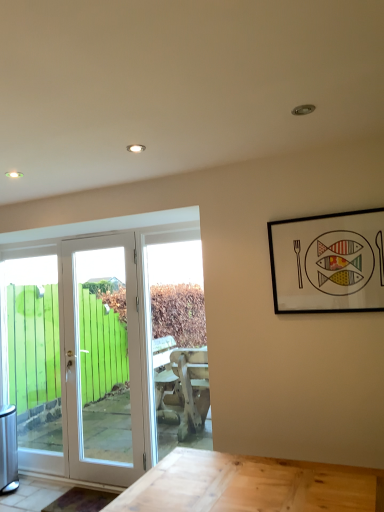
In order to face white glossy door at left, the second door in the left-to-right sequence, should I rotate leftwards or rightwards?

A 11.635 degree turn to the left will do.

What are the coordinates of `transparent glass door at left` in the screenshot? It's located at (33, 358).

What do you see at coordinates (328, 263) in the screenshot? I see `black matte picture frame at upper right` at bounding box center [328, 263].

At what (x,y) coordinates should I click in order to perform the action: click on white glossy door at left, which appears as the first door when viewed from the right. Please return your answer as a coordinate pair (x, y). Image resolution: width=384 pixels, height=512 pixels. Looking at the image, I should click on (104, 358).

Can you confirm if white glossy door at left, positioned as the second door in right-to-left order, is wider than white glossy door at left, the second door in the left-to-right sequence?

No.

Measure the distance between white glossy door at left, positioned as the second door in right-to-left order, and white glossy door at left, the second door in the left-to-right sequence.

white glossy door at left, positioned as the second door in right-to-left order, is 5.31 inches away from white glossy door at left, the second door in the left-to-right sequence.

Are white glossy door at left, the 1th door when ordered from left to right, and white glossy door at left, which appears as the first door when viewed from the right, far apart?

No.

Is white glossy door at left, which appears as the first door when viewed from the right, at the back of white glossy door at left, positioned as the second door in right-to-left order?

That's right, white glossy door at left, positioned as the second door in right-to-left order, is facing away from white glossy door at left, which appears as the first door when viewed from the right.

Is white glossy door at left, the second door in the left-to-right sequence, wider or thinner than transparent glass door at left?

white glossy door at left, the second door in the left-to-right sequence, is wider than transparent glass door at left.

Identify the location of the 1st door in front of the transparent glass door at left, starting your count from the anchor. (104, 358).

Is white glossy door at left, the second door in the left-to-right sequence, situated inside transparent glass door at left or outside?

white glossy door at left, the second door in the left-to-right sequence, exists outside the volume of transparent glass door at left.

Are white glossy door at left, positioned as the second door in right-to-left order, and transparent glass door at left located far from each other?

Actually, white glossy door at left, positioned as the second door in right-to-left order, and transparent glass door at left are a little close together.

What's the angular difference between white glossy door at left, the 1th door when ordered from left to right, and transparent glass door at left's facing directions?

They differ by 0.123 degrees in their facing directions.

Could you tell me if white glossy door at left, positioned as the second door in right-to-left order, is turned towards transparent glass door at left?

Yes, white glossy door at left, positioned as the second door in right-to-left order, is aimed at transparent glass door at left.

Is white glossy door at left, positioned as the second door in right-to-left order, wider than transparent glass door at left?

No.

How different are the orientations of white glossy door at left, which appears as the first door when viewed from the right, and white glossy door at left, positioned as the second door in right-to-left order, in degrees?

A: The angle between the facing direction of white glossy door at left, which appears as the first door when viewed from the right, and the facing direction of white glossy door at left, positioned as the second door in right-to-left order, is 0.123 degrees.

Considering the relative positions of white glossy door at left, the second door in the left-to-right sequence, and white glossy door at left, positioned as the second door in right-to-left order, in the image provided, is white glossy door at left, the second door in the left-to-right sequence, to the left or to the right of white glossy door at left, positioned as the second door in right-to-left order,?

white glossy door at left, the second door in the left-to-right sequence, is positioned on white glossy door at left, positioned as the second door in right-to-left order,'s right side.

From the picture: Between white glossy door at left, which appears as the first door when viewed from the right, and white glossy door at left, positioned as the second door in right-to-left order, which one is positioned in front?

white glossy door at left, positioned as the second door in right-to-left order, is closer to the camera.

The width and height of the screenshot is (384, 512). In order to click on door behind the white glossy door at left, positioned as the second door in right-to-left order in this screenshot , I will do `click(104, 358)`.

Based on their positions, is black matte picture frame at upper right located to the left or right of white glossy door at left, the second door in the left-to-right sequence?

Clearly, black matte picture frame at upper right is on the right of white glossy door at left, the second door in the left-to-right sequence, in the image.

Based on the photo, how many degrees apart are the facing directions of black matte picture frame at upper right and white glossy door at left, which appears as the first door when viewed from the right?

2.3 degrees separate the facing orientations of black matte picture frame at upper right and white glossy door at left, which appears as the first door when viewed from the right.

Which object is thinner, black matte picture frame at upper right or white glossy door at left, which appears as the first door when viewed from the right?

Thinner between the two is black matte picture frame at upper right.

Is black matte picture frame at upper right positioned behind white glossy door at left, positioned as the second door in right-to-left order?

No, black matte picture frame at upper right is in front of white glossy door at left, positioned as the second door in right-to-left order.

Based on the photo, from a real-world perspective, which object stands above the other?

From a 3D spatial view, black matte picture frame at upper right is above.

In the scene shown: How different are the orientations of black matte picture frame at upper right and white glossy door at left, positioned as the second door in right-to-left order, in degrees?

The angle between the facing direction of black matte picture frame at upper right and the facing direction of white glossy door at left, positioned as the second door in right-to-left order, is 2.18 degrees.

Considering the relative sizes of black matte picture frame at upper right and transparent glass door at left in the image provided, is black matte picture frame at upper right smaller than transparent glass door at left?

Correct, black matte picture frame at upper right occupies less space than transparent glass door at left.

Does point (366, 307) appear closer or farther from the camera than point (58, 437)?

Clearly, point (366, 307) is closer to the camera than point (58, 437).

In terms of width, does black matte picture frame at upper right look wider or thinner when compared to transparent glass door at left?

In the image, black matte picture frame at upper right appears to be more narrow than transparent glass door at left.

From the image's perspective, between black matte picture frame at upper right and transparent glass door at left, who is located below?

transparent glass door at left, from the image's perspective.

Locate an element on the screen. The image size is (384, 512). door below the white glossy door at left, the second door in the left-to-right sequence (from a real-world perspective) is located at coordinates (106, 342).

The image size is (384, 512). In order to click on window that is behind the white glossy door at left, the second door in the left-to-right sequence in this screenshot , I will do `click(33, 358)`.

Which object lies further to the anchor point white glossy door at left, the 1th door when ordered from left to right, black matte picture frame at upper right or transparent glass door at left?

black matte picture frame at upper right.

Based on their spatial positions, is white glossy door at left, the 1th door when ordered from left to right, or white glossy door at left, which appears as the first door when viewed from the right, further from black matte picture frame at upper right?

white glossy door at left, which appears as the first door when viewed from the right, is further to black matte picture frame at upper right.

Estimate the real-world distances between objects in this image. Which object is further from black matte picture frame at upper right, white glossy door at left, which appears as the first door when viewed from the right, or white glossy door at left, the 1th door when ordered from left to right?

white glossy door at left, which appears as the first door when viewed from the right, lies further to black matte picture frame at upper right than the other object.

When comparing their distances from black matte picture frame at upper right, does transparent glass door at left or white glossy door at left, which appears as the first door when viewed from the right, seem further?

transparent glass door at left.

Based on their spatial positions, is black matte picture frame at upper right or white glossy door at left, the second door in the left-to-right sequence, further from white glossy door at left, positioned as the second door in right-to-left order?

black matte picture frame at upper right is positioned further to the anchor white glossy door at left, positioned as the second door in right-to-left order.

Which object lies nearer to the anchor point white glossy door at left, the second door in the left-to-right sequence, white glossy door at left, positioned as the second door in right-to-left order, or black matte picture frame at upper right?

The object closer to white glossy door at left, the second door in the left-to-right sequence, is white glossy door at left, positioned as the second door in right-to-left order.

When comparing their distances from white glossy door at left, which appears as the first door when viewed from the right, does white glossy door at left, positioned as the second door in right-to-left order, or transparent glass door at left seem further?

transparent glass door at left is positioned further to the anchor white glossy door at left, which appears as the first door when viewed from the right.

Looking at this image, which object lies further to the anchor point transparent glass door at left, black matte picture frame at upper right or white glossy door at left, the second door in the left-to-right sequence?

black matte picture frame at upper right is further to transparent glass door at left.

The height and width of the screenshot is (512, 384). In order to click on door between white glossy door at left, positioned as the second door in right-to-left order, and black matte picture frame at upper right in this screenshot , I will do `click(104, 358)`.

Where is `door between transparent glass door at left and white glossy door at left, the second door in the left-to-right sequence`? Image resolution: width=384 pixels, height=512 pixels. door between transparent glass door at left and white glossy door at left, the second door in the left-to-right sequence is located at coordinates (106, 342).